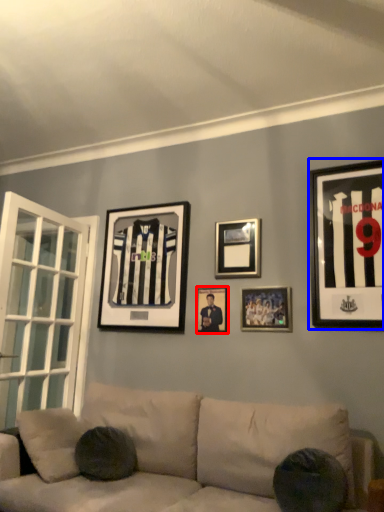
Question: Which point is further to the camera, picture frame (highlighted by a red box) or picture frame (highlighted by a blue box)?

Choices:
 (A) picture frame
 (B) picture frame

Answer: (A)